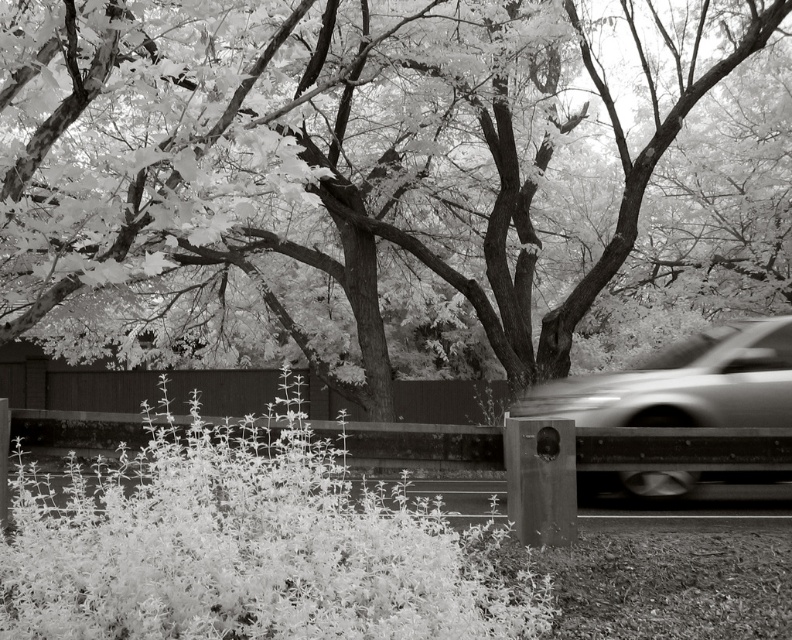
Question: Is smooth bark tree at center to the right of metallic silver car at right from the viewer's perspective?

Choices:
 (A) no
 (B) yes

Answer: (A)

Question: Does smooth bark tree at center appear on the left side of metallic silver car at right?

Choices:
 (A) no
 (B) yes

Answer: (B)

Question: Among these points, which one is farthest from the camera?

Choices:
 (A) (486, 131)
 (B) (744, 356)

Answer: (A)

Question: Among these objects, which one is nearest to the camera?

Choices:
 (A) metallic silver car at right
 (B) smooth bark tree at center

Answer: (B)

Question: Is smooth bark tree at center thinner than metallic silver car at right?

Choices:
 (A) yes
 (B) no

Answer: (B)

Question: Which of the following is the farthest from the observer?

Choices:
 (A) (749, 324)
 (B) (518, 323)

Answer: (B)